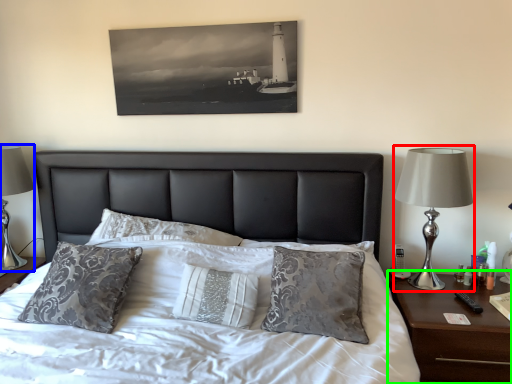
Question: Which object is the farthest from bedside lamp (highlighted by a red box)? Choose among these: table lamp (highlighted by a blue box) or nightstand (highlighted by a green box).

Choices:
 (A) table lamp
 (B) nightstand

Answer: (A)